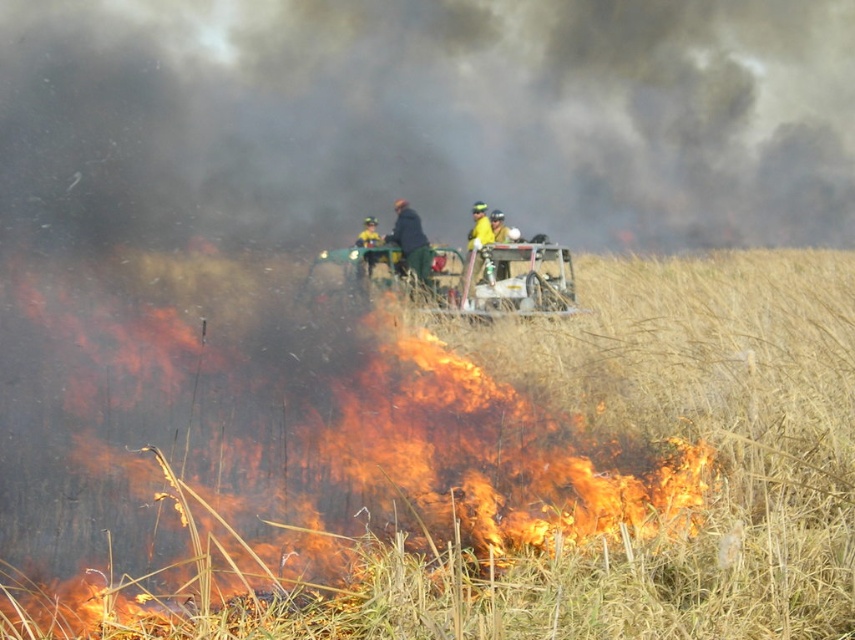
Which is more to the left, dark blue jacket at center or yellow reflective jacket at center?

yellow reflective jacket at center is more to the left.

Does point (385, 237) lie behind point (370, 253)?

Yes.

Where is `dark blue jacket at center`? dark blue jacket at center is located at coordinates (411, 243).

Which of these two, flaming grass at center or dark blue jacket at center, stands shorter?

With less height is flaming grass at center.

Which is in front, point (116, 406) or point (429, 292)?

Point (116, 406)

Find the location of a particular element. flaming grass at center is located at coordinates (342, 452).

Between point (416, 234) and point (482, 268), which one is positioned in front?

Point (482, 268) is more forward.

Is dark blue jacket at center thinner than yellow fabric helmet at center?

Incorrect, dark blue jacket at center's width is not less than yellow fabric helmet at center's.

Is point (417, 269) less distant than point (481, 241)?

Yes, it is in front of point (481, 241).

At what (x,y) coordinates should I click in order to perform the action: click on dark blue jacket at center. Please return your answer as a coordinate pair (x, y). This screenshot has height=640, width=855. Looking at the image, I should click on (411, 243).